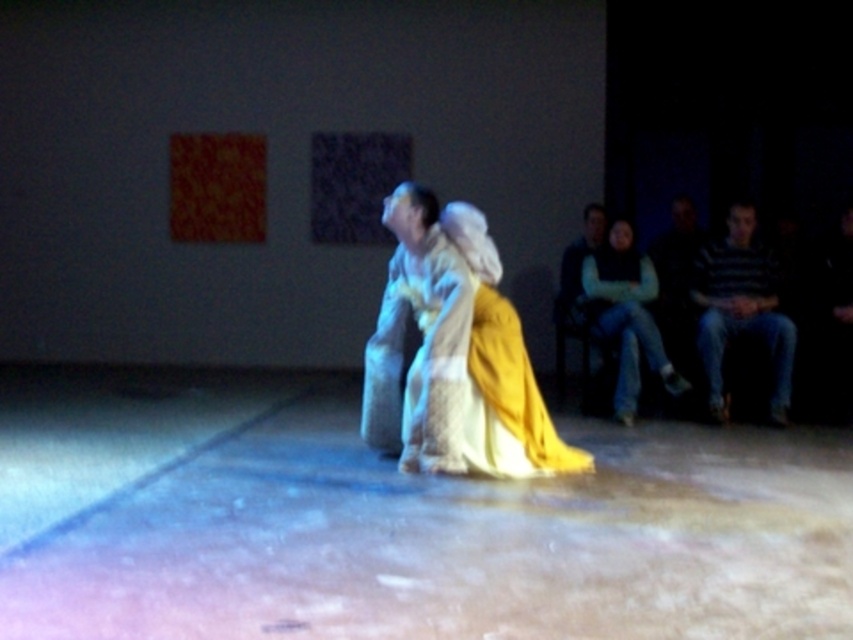
Is matte white dress at center positioned before striped sweater at right?

Yes, it is.

Measure the distance between matte white dress at center and camera.

They are 4.97 meters apart.

This screenshot has width=853, height=640. Identify the location of matte white dress at center. (454, 353).

Between striped sweater at right and light green sweater at right, which one has less height?

light green sweater at right

Describe the element at coordinates (741, 308) in the screenshot. Image resolution: width=853 pixels, height=640 pixels. I see `striped sweater at right` at that location.

At what (x,y) coordinates should I click in order to perform the action: click on striped sweater at right. Please return your answer as a coordinate pair (x, y). The width and height of the screenshot is (853, 640). Looking at the image, I should click on (741, 308).

Measure the distance between matte white dress at center and camera.

They are 4.97 meters apart.

Which of these two, matte white dress at center or light green sweater at right, stands shorter?

Standing shorter between the two is light green sweater at right.

This screenshot has width=853, height=640. Describe the element at coordinates (454, 353) in the screenshot. I see `matte white dress at center` at that location.

The width and height of the screenshot is (853, 640). I want to click on matte white dress at center, so click(x=454, y=353).